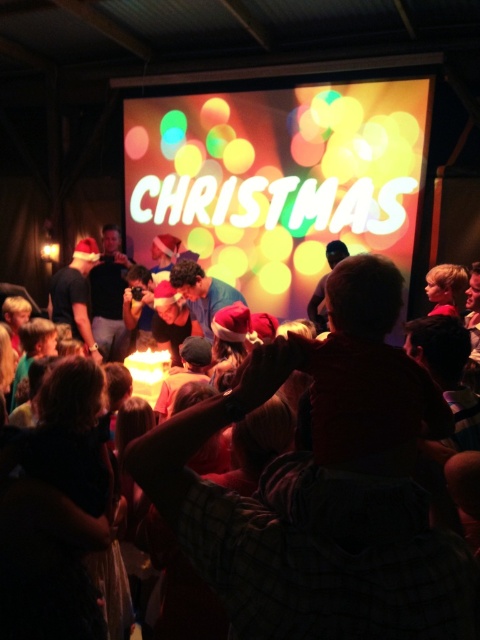
You are a photographer at the Christmas gathering. You want to take a photo of the neon sign at center and the matte black shirt at center. Which object should you focus on first to ensure both are in focus?

The neon sign at center is closer to the viewer than the matte black shirt at center, so you should focus on the neon sign at center first to ensure both are in focus.

You are a photographer at the Christmas gathering. You want to take a photo of the matte black shirt at center without the matte red hat at center appearing in the foreground. Is this possible?

The matte red hat at center is below the matte black shirt at center, so the matte red hat at center would be in the foreground of the matte black shirt at center. Therefore, it would be difficult to take a photo of the matte black shirt at center without the matte red hat at center appearing in the foreground.

You are organizing a photo shoot and need to ensure that both the matte red hat at center and the matte black shirt at center are in focus. The camera you are using has a depth of field that can cover objects within a 3.5 meter range. Can you capture both items in focus without adjusting your camera settings?

The matte red hat at center and the matte black shirt at center are 3.37 meters apart. Since the camera can cover 3.5 meters, both items can be captured in focus without adjusting settings.